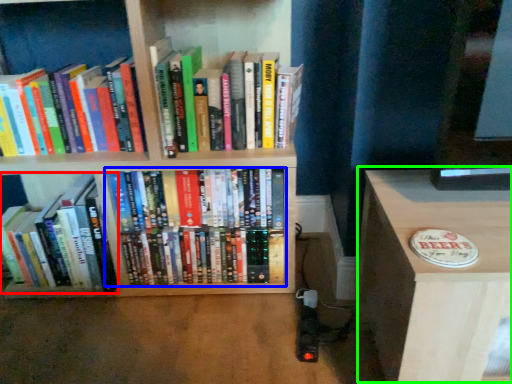
Question: Which object is the closest to the book (highlighted by a red box)? Choose among these: book (highlighted by a blue box) or table (highlighted by a green box).

Choices:
 (A) book
 (B) table

Answer: (A)